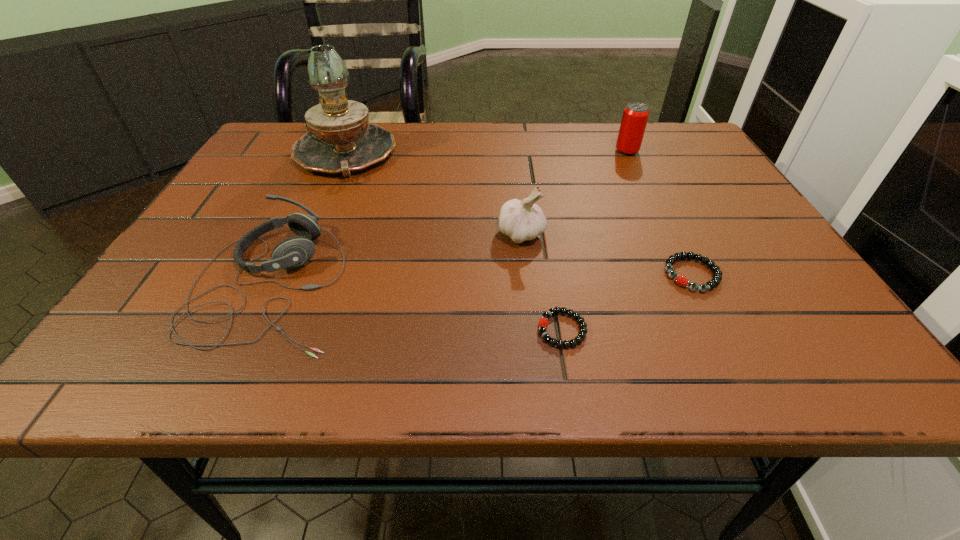
Locate an element on the screen. vacant region that satisfies the following two spatial constraints: 1. on the outer surface of the nearer bracelet; 2. on the left side of the third shortest object is located at coordinates (249, 329).

Image resolution: width=960 pixels, height=540 pixels. I want to click on free spot that satisfies the following two spatial constraints: 1. on the back side of the shortest object; 2. on the outer surface of the headset, so click(554, 283).

The width and height of the screenshot is (960, 540). In order to click on free space that satisfies the following two spatial constraints: 1. on the front side of the oil lamp; 2. on the right side of the taller bracelet in this screenshot , I will do coord(292,274).